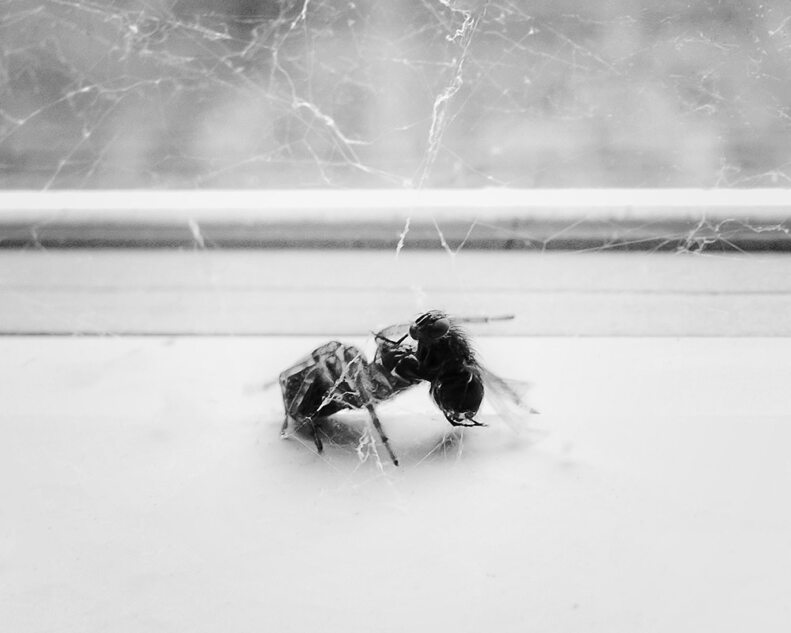
Where is `cobwebs`? Image resolution: width=791 pixels, height=633 pixels. cobwebs is located at coordinates (369, 448), (347, 377), (414, 211), (316, 99), (693, 229).